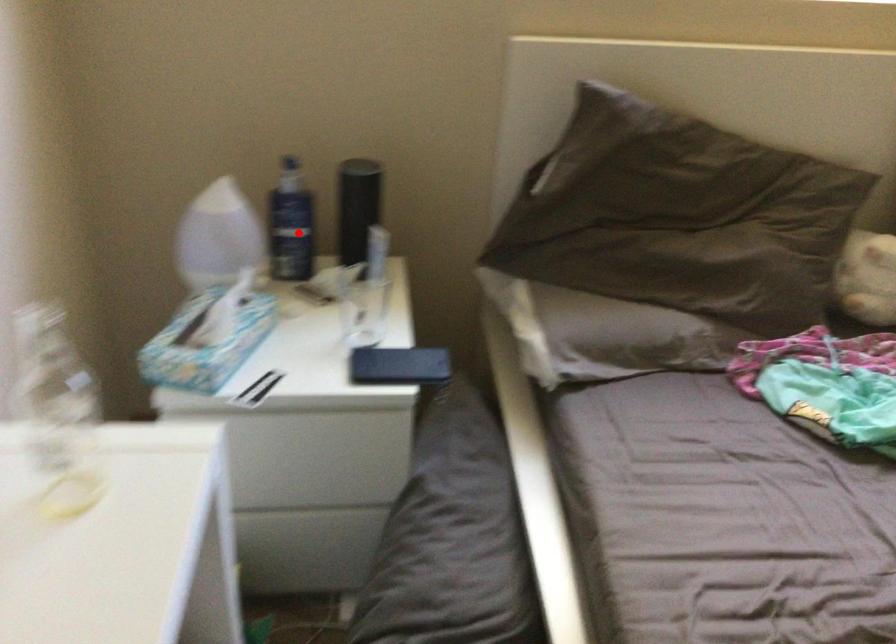
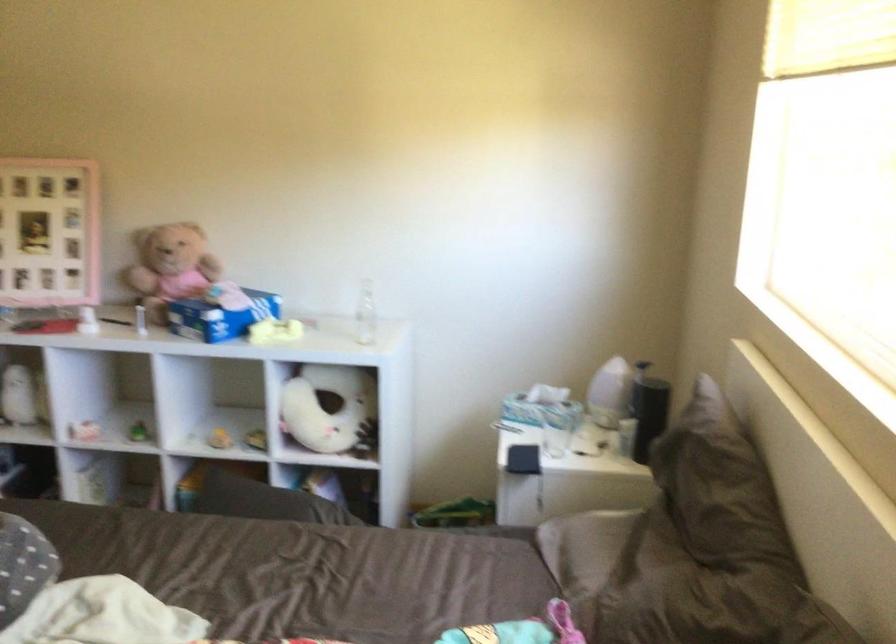
Question: A red point is marked in image1. In image2, is the corresponding 3D point closer to the camera or farther? Reply with the corresponding letter.

Choices:
 (A) The corresponding 3D point is closer.
 (B) The corresponding 3D point is farther.

Answer: (B)